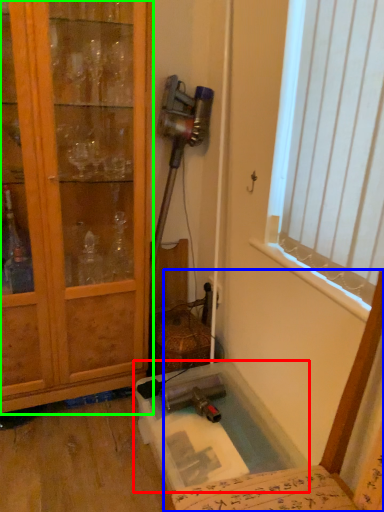
Question: Which object is positioned farthest from bath (highlighted by a red box)? Select from chair (highlighted by a blue box) and cabinetry (highlighted by a green box).

Choices:
 (A) chair
 (B) cabinetry

Answer: (B)